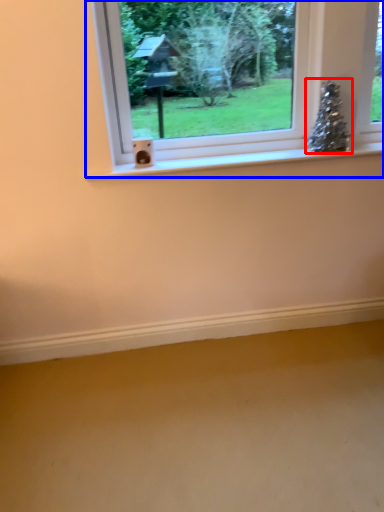
Question: Which point is closer to the camera, christmas tree (highlighted by a red box) or window (highlighted by a blue box)?

Choices:
 (A) christmas tree
 (B) window

Answer: (B)